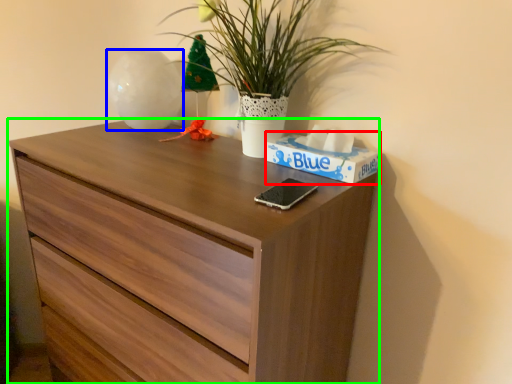
Question: Considering the real-world distances, which object is farthest from box (highlighted by a red box)? vase (highlighted by a blue box) or chest of drawers (highlighted by a green box)?

Choices:
 (A) vase
 (B) chest of drawers

Answer: (A)